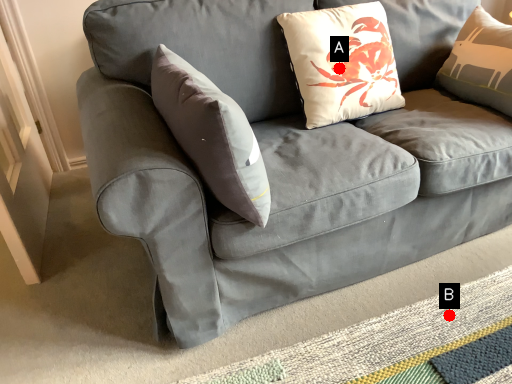
Question: Two points are circled on the image, labeled by A and B beside each circle. Which point is farther from the camera taking this photo?

Choices:
 (A) A is further
 (B) B is further

Answer: (A)